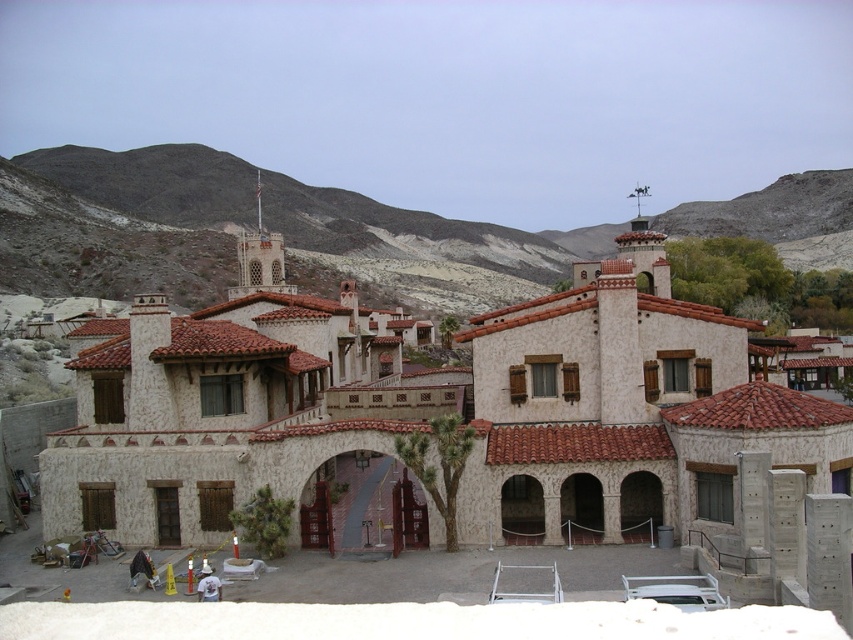
You are a drone operator tasked with capturing aerial footage of the white stucco building at center and the gray rocky mountain at upper center. Based on their sizes, which object should you prioritize to ensure both are fully visible in the frame without needing to adjust the camera angle?

The white stucco building at center has a smaller width compared to the gray rocky mountain at upper center. To ensure both are fully visible in the frame, prioritize positioning the camera to accommodate the larger gray rocky mountain at upper center first, then adjust slightly to include the smaller white stucco building at center without needing major angle changes.

You are an architect planning to install a flagpole on the highest point of the white stucco building at center. Considering the gray rocky mountain at upper center, which is taller than the building, will the flagpole be visible from the mountain?

The white stucco building at center has a lesser height compared to the gray rocky mountain at upper center, so the flagpole installed on the building will not be visible from the mountain due to the mountain being taller.

You are standing at point (434, 412) in the scene. What object is located exactly at this point?

The white stucco building at center is located exactly at point (434, 412).